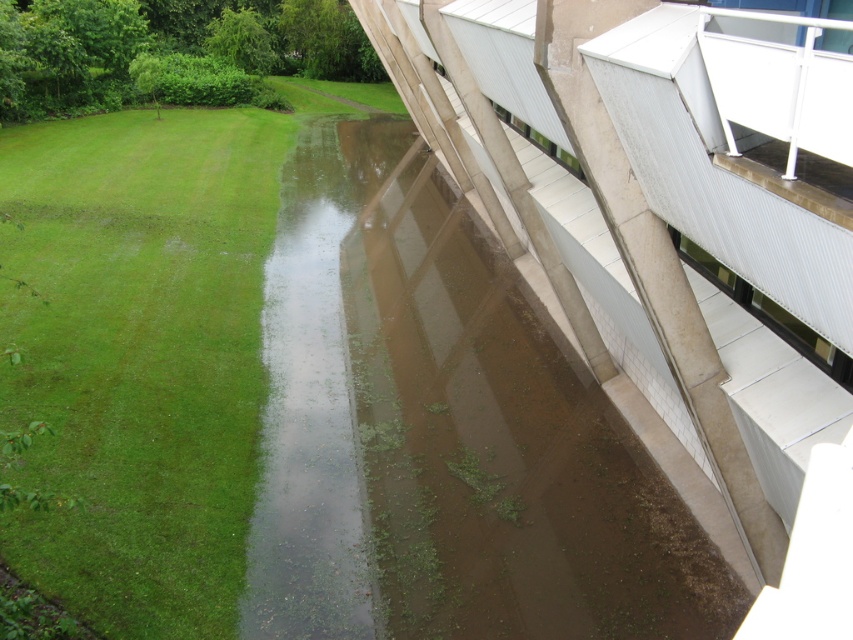
Is brown concrete at center above green grass at lower left?

No, brown concrete at center is not above green grass at lower left.

Is point (457, 476) positioned behind point (128, 352)?

No.

Find the location of a particular element. brown concrete at center is located at coordinates (444, 435).